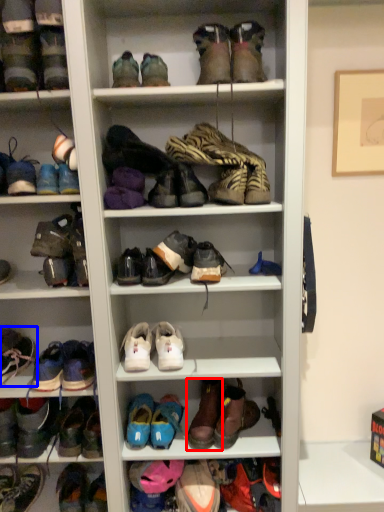
Question: Among these objects, which one is nearest to the camera, shoe (highlighted by a red box) or footwear (highlighted by a blue box)?

Choices:
 (A) shoe
 (B) footwear

Answer: (B)